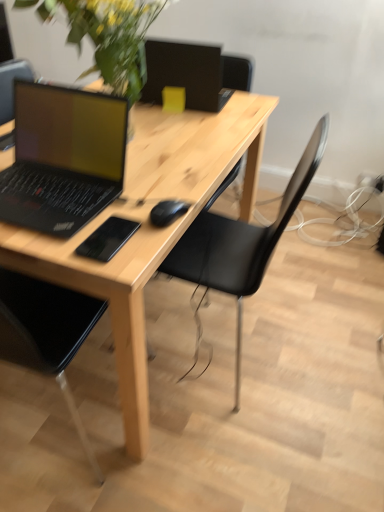
Where is `matte black laptop at left`? This screenshot has height=512, width=384. matte black laptop at left is located at coordinates (63, 158).

What do you see at coordinates (63, 158) in the screenshot?
I see `matte black laptop at left` at bounding box center [63, 158].

Where is `black plastic chair at center`? The image size is (384, 512). black plastic chair at center is located at coordinates (241, 243).

You are a GUI agent. You are given a task and a screenshot of the screen. Output one action in this format:
    pyautogui.click(x=<x>, y=<y>)
    Task: Click on the matte black laptop at left
    This screenshot has width=384, height=512.
    Given the screenshot: What is the action you would take?
    pyautogui.click(x=63, y=158)

Consider the image. Between black matte mouse at center and matte black laptop at left, which one is positioned behind?

black matte mouse at center is more distant.

Is black matte mouse at center positioned with its back to matte black laptop at left?

No, black matte mouse at center is not facing the opposite direction of matte black laptop at left.

From a real-world perspective, is black matte mouse at center above or below matte black laptop at left?

In terms of real-world spatial position, black matte mouse at center is below matte black laptop at left.

Looking at the image, does matte black laptop at left seem bigger or smaller compared to natural wood desk at center?

In the image, matte black laptop at left appears to be smaller than natural wood desk at center.

Is matte black laptop at left facing towards natural wood desk at center?

No, matte black laptop at left is not oriented towards natural wood desk at center.

Is matte black laptop at left positioned beyond the bounds of natural wood desk at center?

Indeed, matte black laptop at left is completely outside natural wood desk at center.

From a real-world perspective, does green leafy plant at upper left stand above natural wood desk at center?

Yes, from a real-world perspective, green leafy plant at upper left is on top of natural wood desk at center.

From the image's perspective, would you say green leafy plant at upper left is shown under natural wood desk at center?

Actually, green leafy plant at upper left appears above natural wood desk at center in the image.

Does green leafy plant at upper left have a smaller size compared to natural wood desk at center?

Correct, green leafy plant at upper left occupies less space than natural wood desk at center.

Is black matte mouse at center oriented towards black plastic chair at center?

No, black matte mouse at center is not oriented towards black plastic chair at center.

Can you confirm if black matte mouse at center is positioned to the right of black plastic chair at center?

Incorrect, black matte mouse at center is not on the right side of black plastic chair at center.

Considering the sizes of objects black matte mouse at center and black plastic chair at center in the image provided, who is wider, black matte mouse at center or black plastic chair at center?

black plastic chair at center is wider.

Could you tell me if matte black laptop at left is facing black matte mouse at center?

No, matte black laptop at left does not turn towards black matte mouse at center.

From the image's perspective, is matte black laptop at left below black matte mouse at center?

Incorrect, from the image's perspective, matte black laptop at left is higher than black matte mouse at center.

Can you confirm if matte black laptop at left is taller than black matte mouse at center?

Yes, matte black laptop at left is taller than black matte mouse at center.

From a real-world perspective, is matte black laptop at left on top of black matte mouse at center?

Yes, from a real-world perspective, matte black laptop at left is over black matte mouse at center

Measure the distance between green leafy plant at upper left and black plastic chair at center.

The distance of green leafy plant at upper left from black plastic chair at center is 57.73 centimeters.

Considering the points (52, 6) and (311, 157), which point is behind, point (52, 6) or point (311, 157)?

Point (311, 157)

Does green leafy plant at upper left have a smaller size compared to black plastic chair at center?

Yes.

From the image's perspective, would you say green leafy plant at upper left is positioned over black plastic chair at center?

Yes.

From a real-world perspective, who is located lower, green leafy plant at upper left or matte black laptop at left?

matte black laptop at left is physically lower.

Does green leafy plant at upper left turn towards matte black laptop at left?

No, green leafy plant at upper left is not turned towards matte black laptop at left.

Is green leafy plant at upper left next to matte black laptop at left?

They are not placed beside each other.

Locate an element on the screen. The image size is (384, 512). floral arrangement above the matte black laptop at left (from the image's perspective) is located at coordinates (111, 37).

At what (x,y) coordinates should I click in order to perform the action: click on laptop that is in front of the black matte mouse at center. Please return your answer as a coordinate pair (x, y). Image resolution: width=384 pixels, height=512 pixels. Looking at the image, I should click on (63, 158).

I want to click on desk located on the right of matte black laptop at left, so click(x=149, y=227).

Estimate the real-world distances between objects in this image. Which object is further from natural wood desk at center, black matte mouse at center or matte black laptop at left?

black matte mouse at center lies further to natural wood desk at center than the other object.

Looking at the image, which one is located further to matte black laptop at left, black matte mousepad at center or natural wood desk at center?

black matte mousepad at center is further to matte black laptop at left.

Considering their positions, is matte black laptop at left positioned further to black plastic chair at center than green leafy plant at upper left?

green leafy plant at upper left is positioned further to the anchor black plastic chair at center.

Considering their positions, is black matte mousepad at center positioned further to black matte mouse at center than green leafy plant at upper left?

green leafy plant at upper left.

Considering their positions, is black matte mousepad at center positioned closer to black matte mouse at center than matte black laptop at left?

black matte mousepad at center.

When comparing their distances from black matte mouse at center, does natural wood desk at center or matte black laptop at left seem further?

natural wood desk at center lies further to black matte mouse at center than the other object.

In the scene shown: From the image, which object appears to be nearer to black plastic chair at center, natural wood desk at center or black matte mousepad at center?

natural wood desk at center is closer to black plastic chair at center.

Considering their positions, is matte black laptop at left positioned closer to black matte mouse at center than natural wood desk at center?

matte black laptop at left is positioned closer to the anchor black matte mouse at center.

You are a GUI agent. You are given a task and a screenshot of the screen. Output one action in this format:
    pyautogui.click(x=<x>, y=<y>)
    Task: Click on the desk between matte black laptop at left and black plastic chair at center
    The image size is (384, 512).
    Given the screenshot: What is the action you would take?
    pyautogui.click(x=149, y=227)

I want to click on mouse between black matte mousepad at center and black plastic chair at center from left to right, so click(x=167, y=212).

Where is `mousepad between matte black laptop at left and black matte mouse at center from left to right`? Image resolution: width=384 pixels, height=512 pixels. mousepad between matte black laptop at left and black matte mouse at center from left to right is located at coordinates (107, 239).

Locate an element on the screen. The image size is (384, 512). mouse between natural wood desk at center and black plastic chair at center in the horizontal direction is located at coordinates (167, 212).